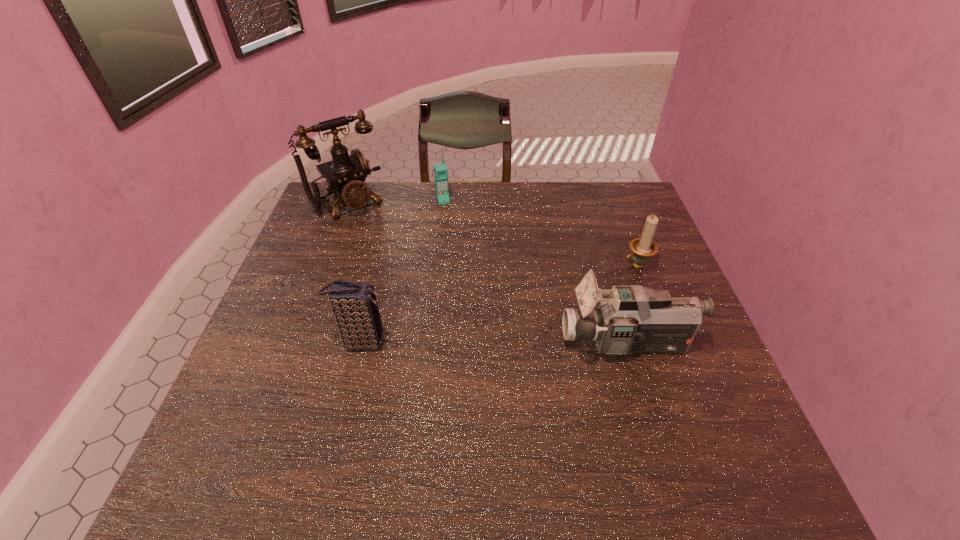
Image resolution: width=960 pixels, height=540 pixels. Identify the location of object at the left edge. (345, 174).

Find the location of `camcorder that is at the right edge`. camcorder that is at the right edge is located at coordinates (633, 319).

I want to click on candle_holder that is at the right edge, so click(x=643, y=248).

Locate an element on the screen. object that is at the far left corner is located at coordinates (345, 174).

Locate an element on the screen. The height and width of the screenshot is (540, 960). vacant area at the far edge is located at coordinates (573, 199).

Where is `free space at the near edge of the desktop`? Image resolution: width=960 pixels, height=540 pixels. free space at the near edge of the desktop is located at coordinates (511, 428).

The height and width of the screenshot is (540, 960). I want to click on free spot at the left edge of the desktop, so click(289, 395).

In the image, there is a desktop. At what (x,y) coordinates should I click in order to perform the action: click on vacant space at the far left corner. Please return your answer as a coordinate pair (x, y). This screenshot has width=960, height=540. Looking at the image, I should click on (345, 209).

Identify the location of vacant space at the far right corner of the desktop. (635, 192).

Image resolution: width=960 pixels, height=540 pixels. In the image, there is a desktop. Find the location of `free region at the near right corner`. free region at the near right corner is located at coordinates (677, 431).